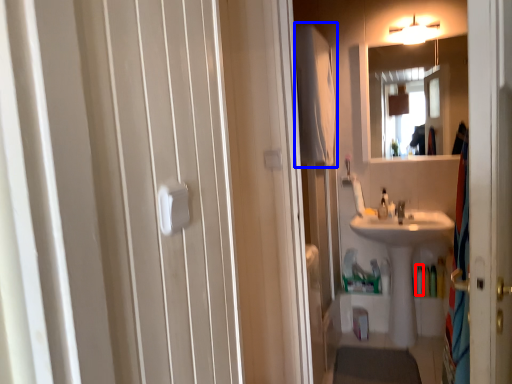
Question: Which of the following is the closest to the observer, toiletry (highlighted by a red box) or bath towel (highlighted by a blue box)?

Choices:
 (A) toiletry
 (B) bath towel

Answer: (B)